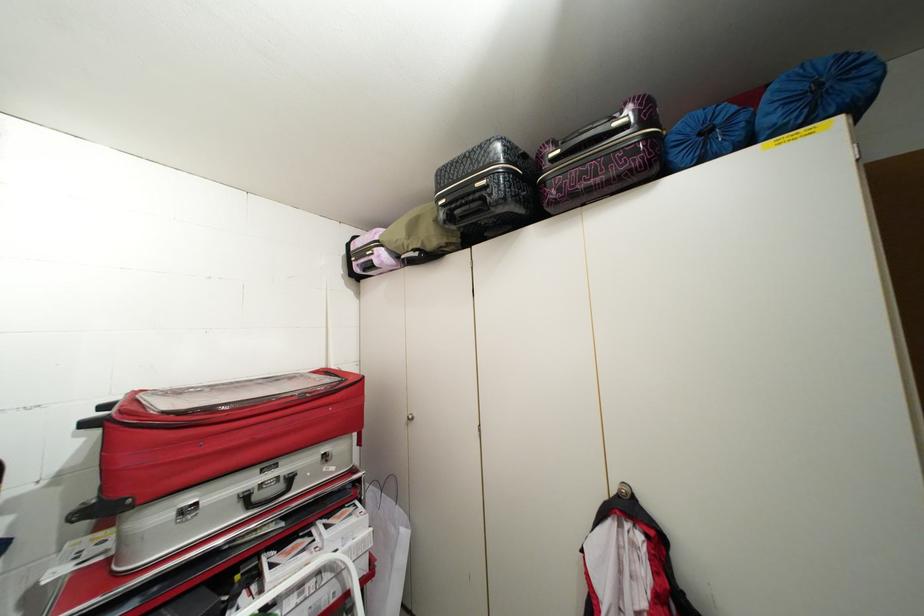
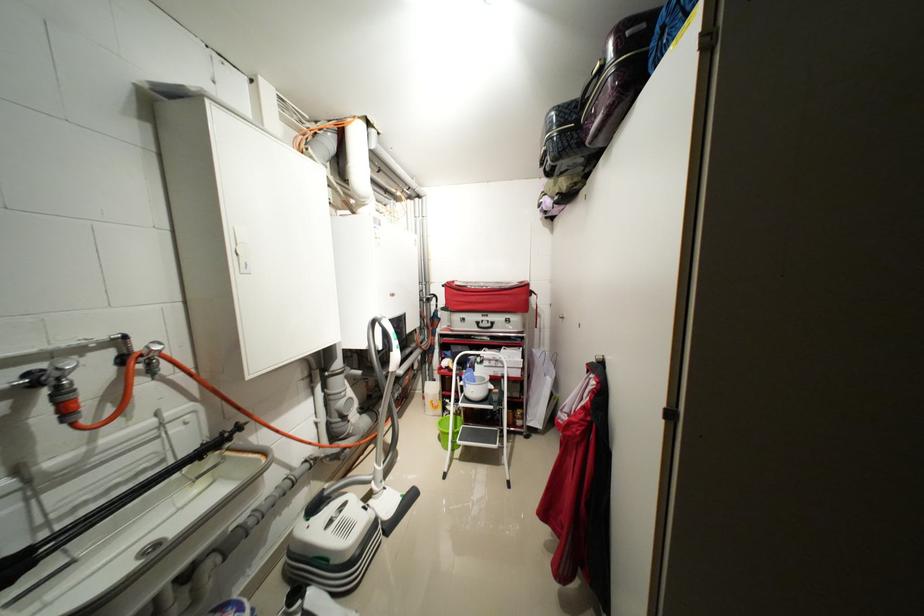
Locate, in the second image, the point that corresponds to pixel 309 586 in the first image.

(496, 361)